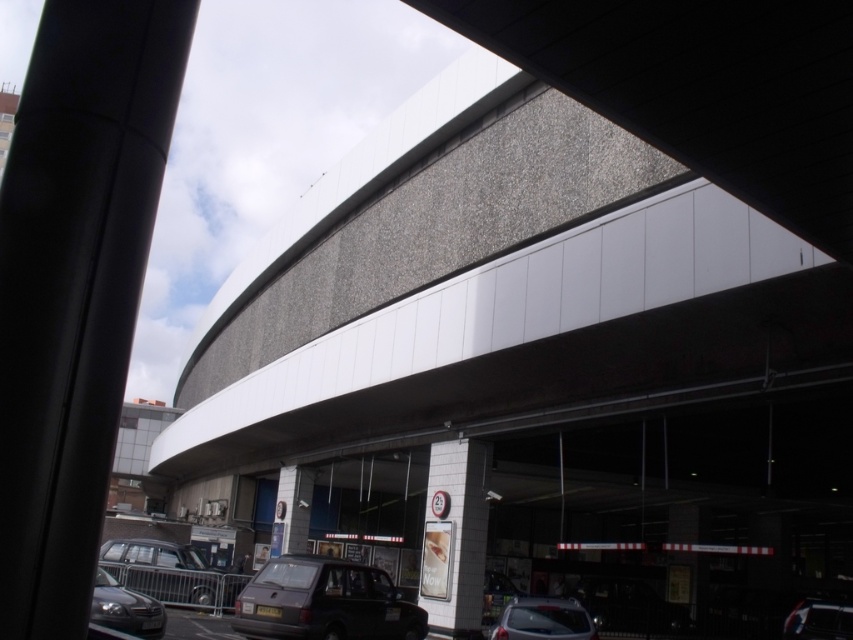
Identify the location of dark gray matte car at lower center. (323, 602).

Is point (312, 582) farther from viewer compared to point (788, 624)?

No, it is not.

Measure the distance between point (357, 573) and camera.

Point (357, 573) and camera are 13.58 meters apart.

At what (x,y) coordinates should I click in order to perform the action: click on dark gray matte car at lower center. Please return your answer as a coordinate pair (x, y). Looking at the image, I should click on (323, 602).

Based on the photo, is metallic gray car at lower center taller than shiny silver sedan at lower left?

Indeed, metallic gray car at lower center has a greater height compared to shiny silver sedan at lower left.

Is metallic gray car at lower center further to the viewer compared to shiny silver sedan at lower left?

No, metallic gray car at lower center is in front of shiny silver sedan at lower left.

Is point (517, 637) farther from viewer compared to point (135, 616)?

No, it is in front of (135, 616).

The image size is (853, 640). Find the location of `metallic gray car at lower center`. metallic gray car at lower center is located at coordinates (543, 620).

Is white matte pillar at center bigger than metallic silver car at lower left?

Yes, white matte pillar at center is bigger than metallic silver car at lower left.

Which of these two, white matte pillar at center or metallic silver car at lower left, stands taller?

Standing taller between the two is white matte pillar at center.

Does point (440, 570) come behind point (151, 572)?

That is False.

The width and height of the screenshot is (853, 640). Find the location of `white matte pillar at center`. white matte pillar at center is located at coordinates coord(454,536).